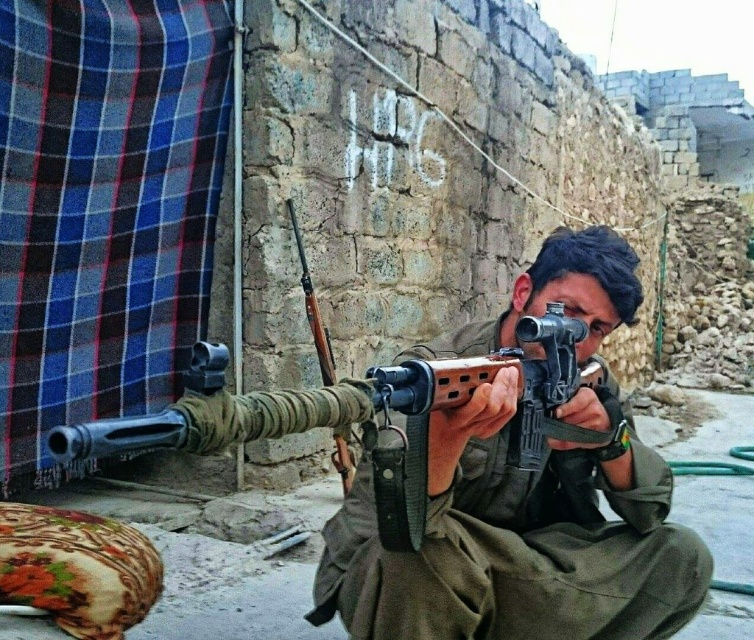
Looking at the scene, which rifle is positioned to the right between the matte black rifle at center and the wooden rifle at center?

The matte black rifle at center is positioned to the right of the wooden rifle at center.

You are a military engineer tasked with transporting two rifles. The matte black rifle at center and the wooden rifle at center must be placed in a storage container that is 2 meters long. Can both rifles fit side by side in the container without overlapping?

The distance between the matte black rifle at center and wooden rifle at center is 2.37 meters. Since the container is only 2 meters long, the two rifles cannot fit side by side without overlapping.

You are a photographer who needs to capture a closeup of the matte black rifle at center. The camera you are using has a minimum focusing distance of 4 feet. Can you take the photo without moving the camera or the rifle?

The matte black rifle at center and camera are 4.51 feet apart. Since the minimum focusing distance is 4 feet, the photographer can take the closeup without moving either because the distance is sufficient.